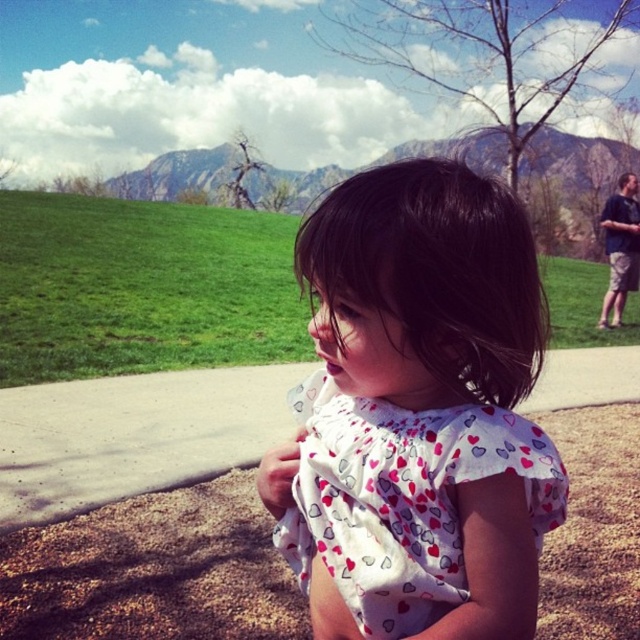
Question: Is white heart-patterned fabric at center to the right of gray concrete pavement at center from the viewer's perspective?

Choices:
 (A) yes
 (B) no

Answer: (A)

Question: Among these points, which one is farthest from the camera?

Choices:
 (A) (358, 573)
 (B) (257, 445)

Answer: (B)

Question: Which object is closer to the camera taking this photo?

Choices:
 (A) gray concrete pavement at center
 (B) dark brown silky hair at center

Answer: (B)

Question: Does dark brown silky hair at center come in front of gray concrete pavement at center?

Choices:
 (A) yes
 (B) no

Answer: (A)

Question: Which object is closer to the camera taking this photo?

Choices:
 (A) gray concrete pavement at center
 (B) white heart-patterned fabric at center
 (C) dark brown silky hair at center

Answer: (C)

Question: Is white heart-patterned fabric at center further to the viewer compared to gray concrete pavement at center?

Choices:
 (A) no
 (B) yes

Answer: (A)